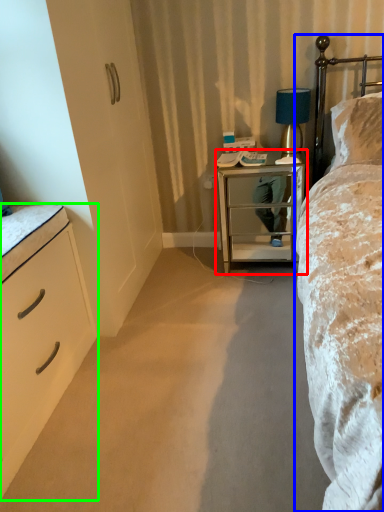
Question: Estimate the real-world distances between objects in this image. Which object is farther from nightstand (highlighted by a red box), bed (highlighted by a blue box) or chest of drawers (highlighted by a green box)?

Choices:
 (A) bed
 (B) chest of drawers

Answer: (B)